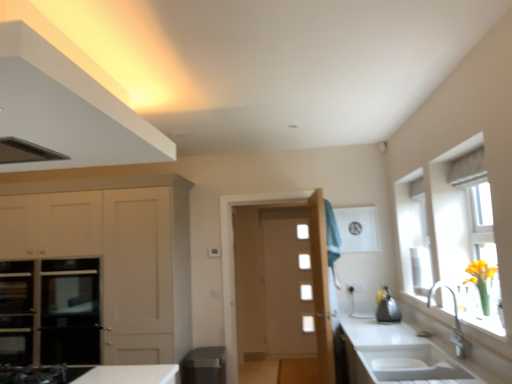
The image size is (512, 384). Describe the element at coordinates (479, 229) in the screenshot. I see `translucent glass window at right` at that location.

What is the approximate height of satin black kettle at right?

satin black kettle at right is 11.64 inches tall.

What do you see at coordinates (388, 309) in the screenshot? I see `satin black kettle at right` at bounding box center [388, 309].

This screenshot has width=512, height=384. Find the location of `matte white cabinet at upper left, placed as the second cabinetry when sorted from back to front`. matte white cabinet at upper left, placed as the second cabinetry when sorted from back to front is located at coordinates (67, 109).

The image size is (512, 384). What do you see at coordinates (404, 364) in the screenshot?
I see `white ceramic sink at lower right` at bounding box center [404, 364].

Find the location of `white matte cabinet at left, the 1th cabinetry positioned from the bottom`. white matte cabinet at left, the 1th cabinetry positioned from the bottom is located at coordinates (118, 246).

You are a GUI agent. You are given a task and a screenshot of the screen. Output one action in this format:
    pyautogui.click(x=<x>, y=<y>)
    Task: Click on the translucent glass window at right
    
    Given the screenshot: What is the action you would take?
    pyautogui.click(x=479, y=229)

Considering the points (15, 287) and (82, 113), which point is behind, point (15, 287) or point (82, 113)?

Point (15, 287)

Can you tell me how much black glass oven at lower left and matte white cabinet at upper left, placed as the 2th cabinetry when sorted from bottom to top, differ in facing direction?

black glass oven at lower left and matte white cabinet at upper left, placed as the 2th cabinetry when sorted from bottom to top, are facing 1.17 degrees away from each other.

Is black glass oven at lower left smaller than matte white cabinet at upper left, which is the 1th cabinetry from front to back?

Yes, black glass oven at lower left is smaller than matte white cabinet at upper left, which is the 1th cabinetry from front to back.

How distant is matte white cabinet at upper left, placed as the second cabinetry when sorted from back to front, from black glass oven at lower left?

matte white cabinet at upper left, placed as the second cabinetry when sorted from back to front, and black glass oven at lower left are 1.85 meters apart.

Is matte white cabinet at upper left, placed as the 2th cabinetry when sorted from bottom to top, aimed at black glass oven at lower left?

No, matte white cabinet at upper left, placed as the 2th cabinetry when sorted from bottom to top, does not turn towards black glass oven at lower left.

Is matte white cabinet at upper left, which is the 1th cabinetry from front to back, to the left of black glass oven at lower left from the viewer's perspective?

No, matte white cabinet at upper left, which is the 1th cabinetry from front to back, is not to the left of black glass oven at lower left.

Between matte white cabinet at upper left, placed as the 2th cabinetry when sorted from bottom to top, and black glass oven at lower left, which one has larger width?

Wider between the two is matte white cabinet at upper left, placed as the 2th cabinetry when sorted from bottom to top.

In the scene shown: Would you say satin black kettle at right is a long distance from black glass oven at lower left?

Indeed, satin black kettle at right is not near black glass oven at lower left.

Does satin black kettle at right have a lesser height compared to black glass oven at lower left?

Indeed, satin black kettle at right has a lesser height compared to black glass oven at lower left.

Is satin black kettle at right not inside black glass oven at lower left?

Yes, satin black kettle at right is located beyond the bounds of black glass oven at lower left.

Is satin black kettle at right closer to camera compared to black glass oven at lower left?

That is True.

Measure the distance between matte white cabinet at upper left, placed as the 2th cabinetry when sorted from bottom to top, and satin black kettle at right.

A distance of 2.81 meters exists between matte white cabinet at upper left, placed as the 2th cabinetry when sorted from bottom to top, and satin black kettle at right.

Does point (50, 114) lie in front of point (383, 298)?

Yes, it is in front of point (383, 298).

From the image's perspective, is matte white cabinet at upper left, which is the 1th cabinetry from front to back, beneath satin black kettle at right?

No, from the image's perspective, matte white cabinet at upper left, which is the 1th cabinetry from front to back, is not beneath satin black kettle at right.

Which of these two, matte white cabinet at upper left, placed as the 2th cabinetry when sorted from bottom to top, or satin black kettle at right, stands shorter?

matte white cabinet at upper left, placed as the 2th cabinetry when sorted from bottom to top.

Is matte white cabinet at upper left, placed as the second cabinetry when sorted from back to front, wider than white glass door at center?

Yes, matte white cabinet at upper left, placed as the second cabinetry when sorted from back to front, is wider than white glass door at center.

Does point (36, 123) come closer to viewer compared to point (296, 273)?

Yes, point (36, 123) is closer to viewer.

From the image's perspective, is matte white cabinet at upper left, placed as the second cabinetry when sorted from back to front, above or below white glass door at center?

matte white cabinet at upper left, placed as the second cabinetry when sorted from back to front, is situated higher than white glass door at center in the image.

Which of these two, matte white cabinet at upper left, which is counted as the 1th cabinetry, starting from the top, or white glass door at center, is smaller?

Smaller between the two is white glass door at center.

Does point (388, 306) lie in front of point (490, 309)?

That is False.

Can you confirm if satin black kettle at right is thinner than translucent glass window at right?

No.

Does satin black kettle at right have a smaller size compared to translucent glass window at right?

Yes.

From the image's perspective, between matte white exhaust hood at upper left and black glass oven at lower left, which one is located above?

matte white exhaust hood at upper left appears higher in the image.

Which is farther from the camera, (32, 159) or (47, 281)?

The point (47, 281) is farther.

Would you consider matte white exhaust hood at upper left to be distant from black glass oven at lower left?

matte white exhaust hood at upper left is positioned a significant distance from black glass oven at lower left.

In the image, is matte white exhaust hood at upper left positioned in front of or behind black glass oven at lower left?

In the image, matte white exhaust hood at upper left appears in front of black glass oven at lower left.

Where is `oven lying behind the matte white cabinet at upper left, placed as the 2th cabinetry when sorted from bottom to top`? The height and width of the screenshot is (384, 512). oven lying behind the matte white cabinet at upper left, placed as the 2th cabinetry when sorted from bottom to top is located at coordinates (51, 311).

I want to click on the 2nd cabinetry above when counting from the black glass oven at lower left (from the image's perspective), so click(67, 109).

Based on their spatial positions, is matte white cabinet at upper left, which is the 1th cabinetry from front to back, or white matte cabinet at left, the 2th cabinetry positioned from the top, further from white ceramic sink at lower right?

Based on the image, white matte cabinet at left, the 2th cabinetry positioned from the top, appears to be further to white ceramic sink at lower right.

Based on their spatial positions, is satin black kettle at right or white matte cabinet at left, arranged as the first cabinetry when viewed from the back, further from white glass door at center?

white matte cabinet at left, arranged as the first cabinetry when viewed from the back, lies further to white glass door at center than the other object.

When comparing their distances from white ceramic sink at lower right, does black glass oven at lower left or white matte cabinet at left, the 1th cabinetry positioned from the bottom, seem closer?

Based on the image, white matte cabinet at left, the 1th cabinetry positioned from the bottom, appears to be nearer to white ceramic sink at lower right.

Based on their spatial positions, is translucent glass window at right or white matte cabinet at left, the 1th cabinetry positioned from the bottom, further from matte white exhaust hood at upper left?

translucent glass window at right is further to matte white exhaust hood at upper left.

Which object lies nearer to the anchor point black glass oven at lower left, matte white cabinet at upper left, which is the 1th cabinetry from front to back, or white glass door at center?

matte white cabinet at upper left, which is the 1th cabinetry from front to back.

Based on their spatial positions, is matte white exhaust hood at upper left or translucent glass window at right closer to white glass door at center?

The object closer to white glass door at center is translucent glass window at right.

Based on their spatial positions, is black glass oven at lower left or white matte cabinet at left, arranged as the first cabinetry when viewed from the back, further from translucent glass window at right?

black glass oven at lower left lies further to translucent glass window at right than the other object.

Estimate the real-world distances between objects in this image. Which object is closer to white glass door at center, white matte cabinet at left, positioned as the 2th cabinetry in front-to-back order, or black glass oven at lower left?

Among the two, white matte cabinet at left, positioned as the 2th cabinetry in front-to-back order, is located nearer to white glass door at center.

In order to click on cabinetry between matte white cabinet at upper left, which is counted as the 1th cabinetry, starting from the top, and black glass oven at lower left from front to back in this screenshot , I will do `click(118, 246)`.

Where is `window between white ceramic sink at lower right and white glass door at center from front to back`? Image resolution: width=512 pixels, height=384 pixels. window between white ceramic sink at lower right and white glass door at center from front to back is located at coordinates (479, 229).

What are the coordinates of `appliance between matte white cabinet at upper left, which is the 1th cabinetry from front to back, and white glass door at center in the front-back direction` in the screenshot? It's located at (388, 309).

Identify the location of oven between white matte cabinet at left, arranged as the first cabinetry when viewed from the back, and translucent glass window at right from left to right. This screenshot has height=384, width=512. click(51, 311).